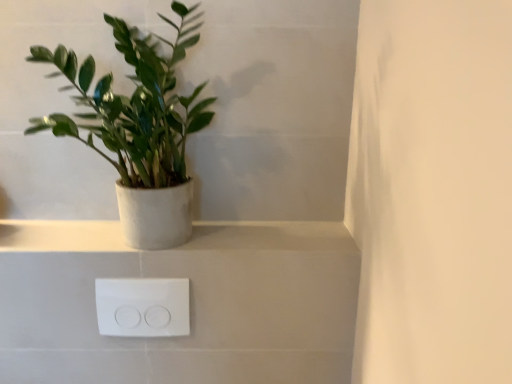
Image resolution: width=512 pixels, height=384 pixels. What do you see at coordinates (143, 307) in the screenshot?
I see `white plastic outlet at lower center` at bounding box center [143, 307].

Identify the location of green matte plant at left. The image size is (512, 384). (138, 129).

Image resolution: width=512 pixels, height=384 pixels. I want to click on white plastic outlet at lower center, so click(x=143, y=307).

Is green matte plant at left positioned before white plastic outlet at lower center?

Yes, green matte plant at left is in front of white plastic outlet at lower center.

Consider the image. Is green matte plant at left in contact with white plastic outlet at lower center?

green matte plant at left is not next to white plastic outlet at lower center, and they're not touching.

Which point is more distant from viewer, (x=84, y=63) or (x=122, y=301)?

The point (x=122, y=301) is behind.

From the picture: From the image's perspective, is white plastic outlet at lower center on top of green matte plant at left?

Incorrect, from the image's perspective, white plastic outlet at lower center is lower than green matte plant at left.

Which of these two, white plastic outlet at lower center or green matte plant at left, is smaller?

With smaller size is white plastic outlet at lower center.

I want to click on houseplant above the white plastic outlet at lower center (from a real-world perspective), so click(x=138, y=129).

Is white plastic outlet at lower center surrounding green matte plant at left?

No, white plastic outlet at lower center does not contain green matte plant at left.

From the image's perspective, is white matte/porcelain shelf at upper center located above white plastic outlet at lower center?

Yes.

Between white matte/porcelain shelf at upper center and white plastic outlet at lower center, which one has less height?

With less height is white matte/porcelain shelf at upper center.

Is white matte/porcelain shelf at upper center in front of or behind white plastic outlet at lower center in the image?

Clearly, white matte/porcelain shelf at upper center is behind white plastic outlet at lower center.

Find the location of a particular element. window sill that is above the white plastic outlet at lower center (from the image's perspective) is located at coordinates (271, 236).

From the picture: From the image's perspective, is white matte/porcelain shelf at upper center located above green matte plant at left?

No, from the image's perspective, white matte/porcelain shelf at upper center is not on top of green matte plant at left.

Is white matte/porcelain shelf at upper center not close to green matte plant at left?

No, white matte/porcelain shelf at upper center is in close proximity to green matte plant at left.

In terms of width, does white matte/porcelain shelf at upper center look wider or thinner when compared to green matte plant at left?

Considering their sizes, white matte/porcelain shelf at upper center looks slimmer than green matte plant at left.

Is green matte plant at left smaller than white matte/porcelain shelf at upper center?

No.

From the image's perspective, which is below, green matte plant at left or white matte/porcelain shelf at upper center?

white matte/porcelain shelf at upper center is shown below in the image.

From a real-world perspective, who is located lower, green matte plant at left or white matte/porcelain shelf at upper center?

From a 3D spatial view, white matte/porcelain shelf at upper center is below.

Considering the points (177, 128) and (106, 223), which point is in front, point (177, 128) or point (106, 223)?

Point (177, 128)

From the image's perspective, which object appears higher, white plastic outlet at lower center or white matte/porcelain shelf at upper center?

white matte/porcelain shelf at upper center.

Which object is further away from the camera taking this photo, white plastic outlet at lower center or white matte/porcelain shelf at upper center?

white matte/porcelain shelf at upper center is further away from the camera.

How many degrees apart are the facing directions of white plastic outlet at lower center and white matte/porcelain shelf at upper center?

They differ by 0.8 degrees in their facing directions.

From a real-world perspective, is white plastic outlet at lower center under white matte/porcelain shelf at upper center?

Indeed, from a real-world perspective, white plastic outlet at lower center is positioned beneath white matte/porcelain shelf at upper center.

Where is `houseplant that is in front of the white plastic outlet at lower center`? This screenshot has width=512, height=384. houseplant that is in front of the white plastic outlet at lower center is located at coordinates (138, 129).

This screenshot has height=384, width=512. I want to click on electric outlet that appears below the green matte plant at left (from a real-world perspective), so click(x=143, y=307).

Estimate the real-world distances between objects in this image. Which object is further from white plastic outlet at lower center, green matte plant at left or white matte/porcelain shelf at upper center?

green matte plant at left is positioned further to the anchor white plastic outlet at lower center.

When comparing their distances from green matte plant at left, does white plastic outlet at lower center or white matte/porcelain shelf at upper center seem closer?

Based on the image, white matte/porcelain shelf at upper center appears to be nearer to green matte plant at left.

Looking at the image, which one is located closer to white matte/porcelain shelf at upper center, white plastic outlet at lower center or green matte plant at left?

white plastic outlet at lower center is closer to white matte/porcelain shelf at upper center.

Which object lies further to the anchor point white plastic outlet at lower center, white matte/porcelain shelf at upper center or green matte plant at left?

green matte plant at left is further to white plastic outlet at lower center.

Which object lies further to the anchor point green matte plant at left, white matte/porcelain shelf at upper center or white plastic outlet at lower center?

white plastic outlet at lower center.

Looking at the image, which one is located further to white matte/porcelain shelf at upper center, green matte plant at left or white plastic outlet at lower center?

green matte plant at left is further to white matte/porcelain shelf at upper center.

Identify the location of window sill between green matte plant at left and white plastic outlet at lower center in the vertical direction. (271, 236).